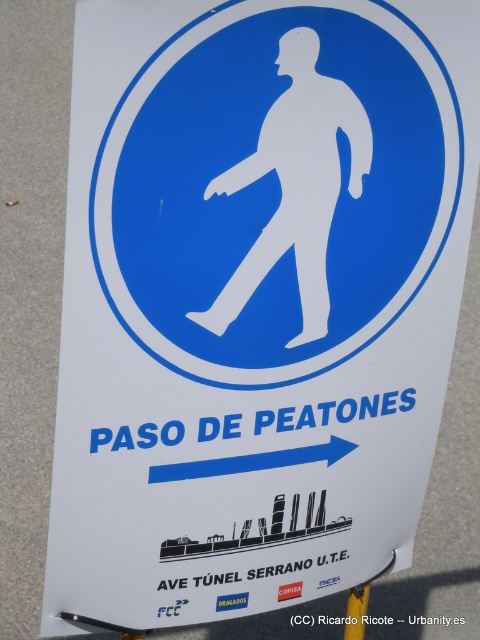
Question: Which point is closer to the camera taking this photo?

Choices:
 (A) (357, 602)
 (B) (218, 332)

Answer: (B)

Question: Is white matte figure at center below yellow plastic pole at lower center?

Choices:
 (A) yes
 (B) no

Answer: (B)

Question: Does white matte figure at center appear under yellow plastic pole at lower center?

Choices:
 (A) no
 (B) yes

Answer: (A)

Question: Which of the following is the closest to the observer?

Choices:
 (A) white matte figure at center
 (B) yellow plastic pole at lower center

Answer: (A)

Question: Which object appears closest to the camera in this image?

Choices:
 (A) white matte figure at center
 (B) yellow plastic pole at lower center

Answer: (A)

Question: Is white matte figure at center above yellow plastic pole at lower center?

Choices:
 (A) yes
 (B) no

Answer: (A)